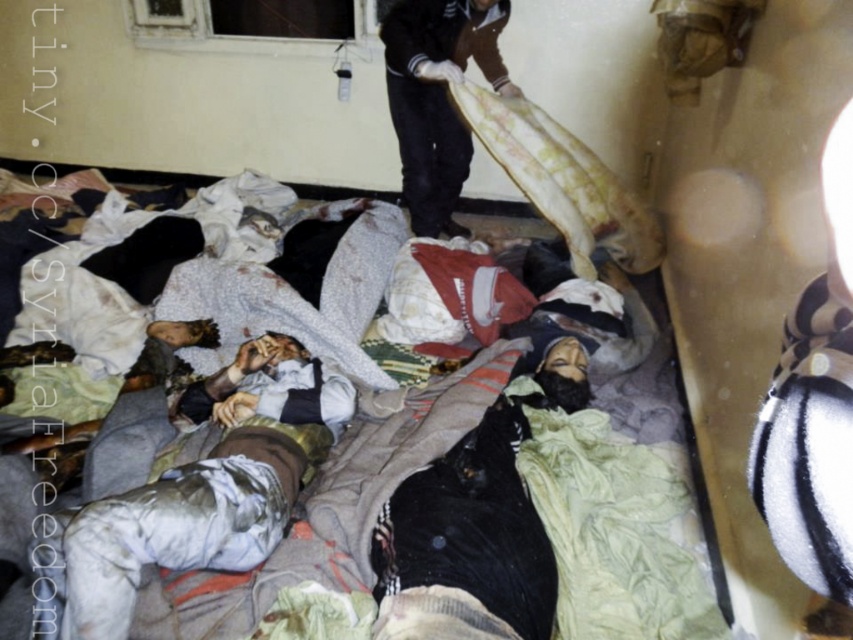
Does white cotton cloth at lower left appear over brown cotton shirt at upper center?

No, white cotton cloth at lower left is not above brown cotton shirt at upper center.

Who is shorter, white cotton cloth at lower left or brown cotton shirt at upper center?

white cotton cloth at lower left is shorter.

You are a GUI agent. You are given a task and a screenshot of the screen. Output one action in this format:
    pyautogui.click(x=<x>, y=<y>)
    Task: Click on the white cotton cloth at lower left
    The width and height of the screenshot is (853, 640).
    Given the screenshot: What is the action you would take?
    pyautogui.click(x=166, y=536)

Which of these two, black cotton shirt at center or white cotton cloth at lower left, stands taller?

Standing taller between the two is black cotton shirt at center.

Identify the location of black cotton shirt at center. (473, 525).

Does white cotton blanket at center have a greater height compared to brown cotton shirt at upper center?

No, white cotton blanket at center is not taller than brown cotton shirt at upper center.

Locate an element on the screen. The height and width of the screenshot is (640, 853). white cotton blanket at center is located at coordinates (547, 502).

Is point (573, 512) farther from viewer compared to point (419, 29)?

No.

You are a GUI agent. You are given a task and a screenshot of the screen. Output one action in this format:
    pyautogui.click(x=<x>, y=<y>)
    Task: Click on the white cotton blanket at center
    Image resolution: width=853 pixels, height=640 pixels.
    Given the screenshot: What is the action you would take?
    pyautogui.click(x=547, y=502)